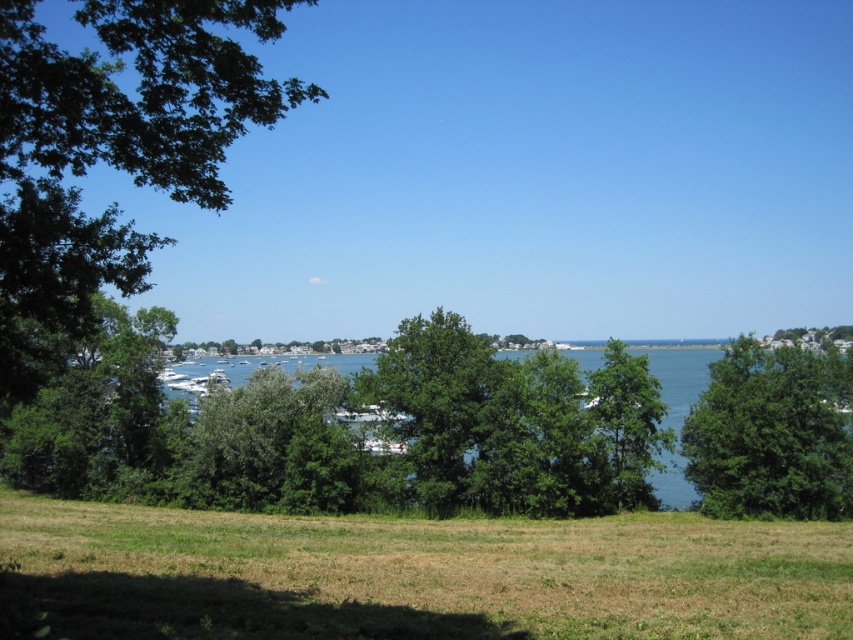
You are standing at the origin point of the coordinate system. You want to walk to the green grassy field at lower center. Which direction should you walk to reach it?

The green grassy field at lower center is located at coordinate point 0.898 on the x axis and 0.487 on the y axis. Since you are at the origin, you should walk in the positive x and positive y direction to reach it.

You are standing at the lakeside and see two points marked in the image. The first point is at coordinates point (x=384, y=378) and the second is at point (x=636, y=448). Which point is closer to you?

Point (x=384, y=378) is further to the camera than point (x=636, y=448), so the point closer to you is point (x=636, y=448).